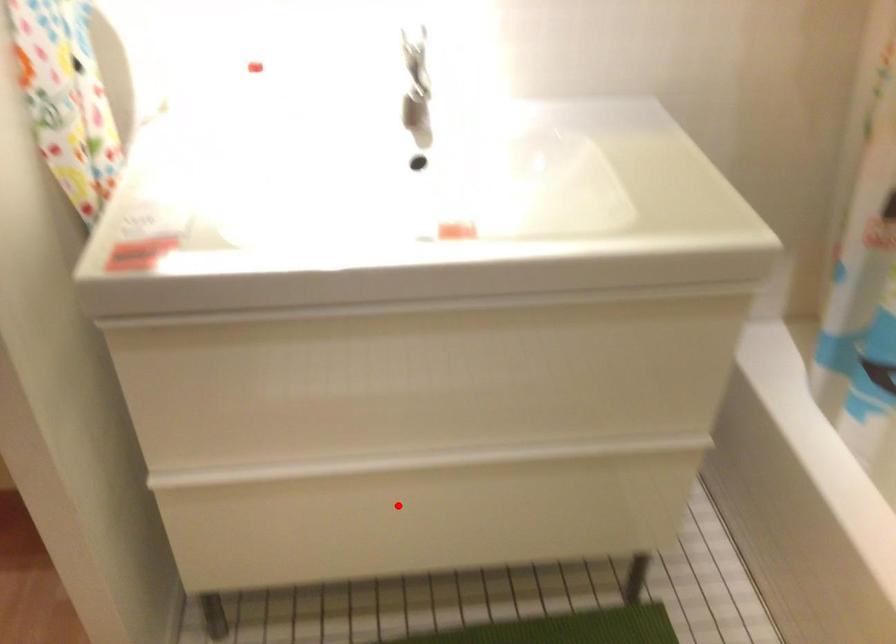
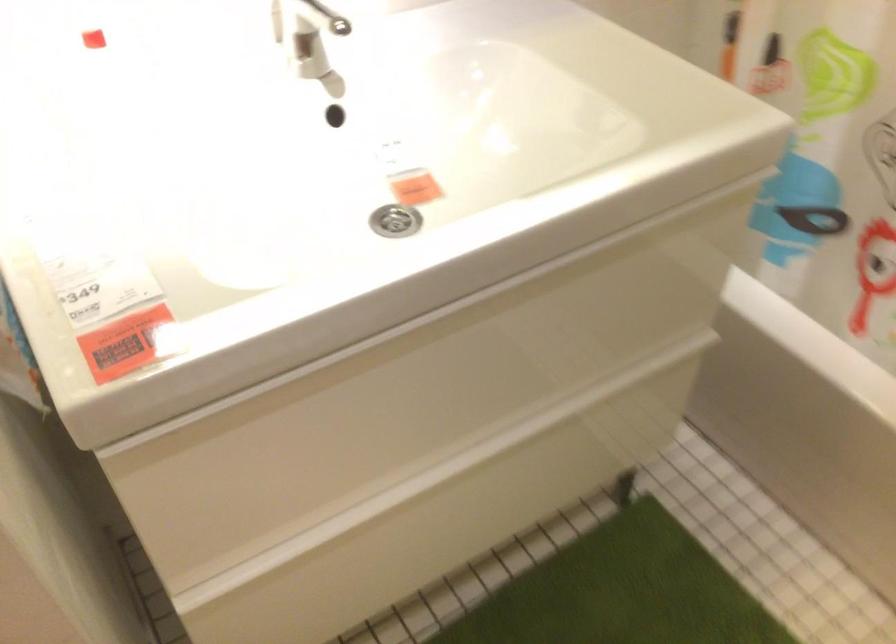
Question: A red point is marked in image1. In image2, is the corresponding 3D point closer to the camera or farther? Reply with the corresponding letter.

Choices:
 (A) The corresponding 3D point is closer.
 (B) The corresponding 3D point is farther.

Answer: (A)